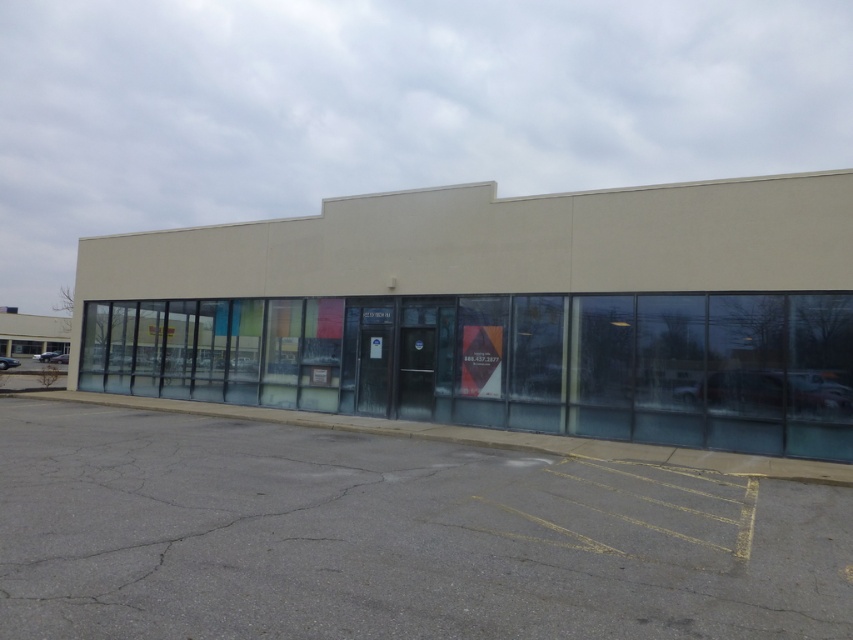
Can you confirm if beige concrete building at center is thinner than gray asphalt parking lot at lower center?

No.

Does beige concrete building at center appear on the right side of gray asphalt parking lot at lower center?

In fact, beige concrete building at center is to the left of gray asphalt parking lot at lower center.

Identify the location of beige concrete building at center. Image resolution: width=853 pixels, height=640 pixels. (503, 310).